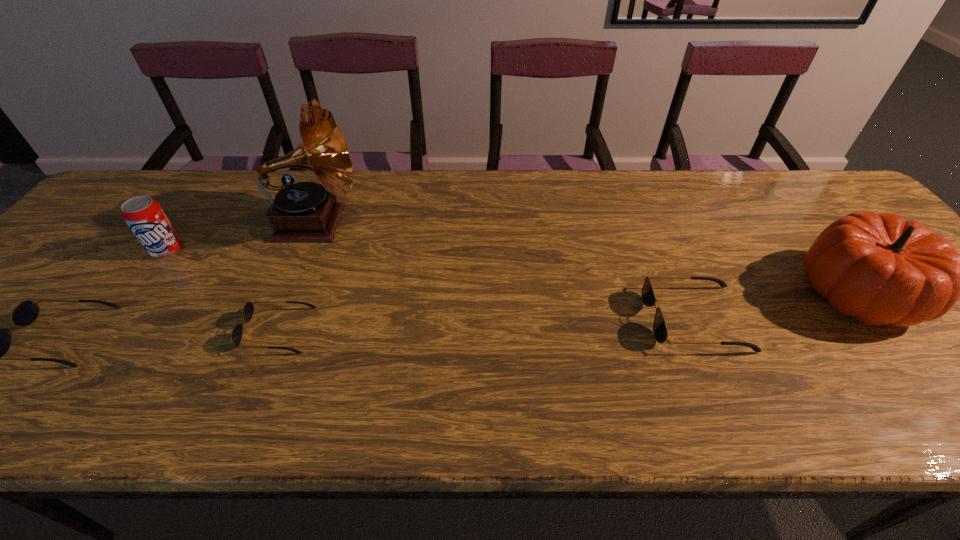
I want to click on free space between the third tallest object and the shortest object, so click(x=223, y=290).

Identify the location of object that stands as the fifth closest to the shortest object. click(x=879, y=268).

Select which object is the second closest to the rightmost object. Please provide its 2D coordinates. Your answer should be formatted as a tuple, i.e. [(x, y)], where the tuple contains the x and y coordinates of a point satisfying the conditions above.

[(305, 211)]

Locate an element on the screen. The height and width of the screenshot is (540, 960). sunglasses object that ranks as the second closest to the pumpkin is located at coordinates (248, 310).

Where is `the second closest sunglasses to the fourth shortest object`? The height and width of the screenshot is (540, 960). the second closest sunglasses to the fourth shortest object is located at coordinates (248, 310).

Locate an element on the screen. Image resolution: width=960 pixels, height=540 pixels. free point that satisfies the following two spatial constraints: 1. on the horn of the phonograph_record; 2. on the surface of the third tallest object is located at coordinates (306, 250).

At what (x,y) coordinates should I click in order to perform the action: click on free space that satisfies the following two spatial constraints: 1. on the horn of the phonograph_record; 2. on the surface of the fourth shortest object. Please return your answer as a coordinate pair (x, y). The height and width of the screenshot is (540, 960). Looking at the image, I should click on (306, 250).

I want to click on free point that satisfies the following two spatial constraints: 1. on the horn of the tallest object; 2. on the surface of the fourth shortest object, so click(x=306, y=250).